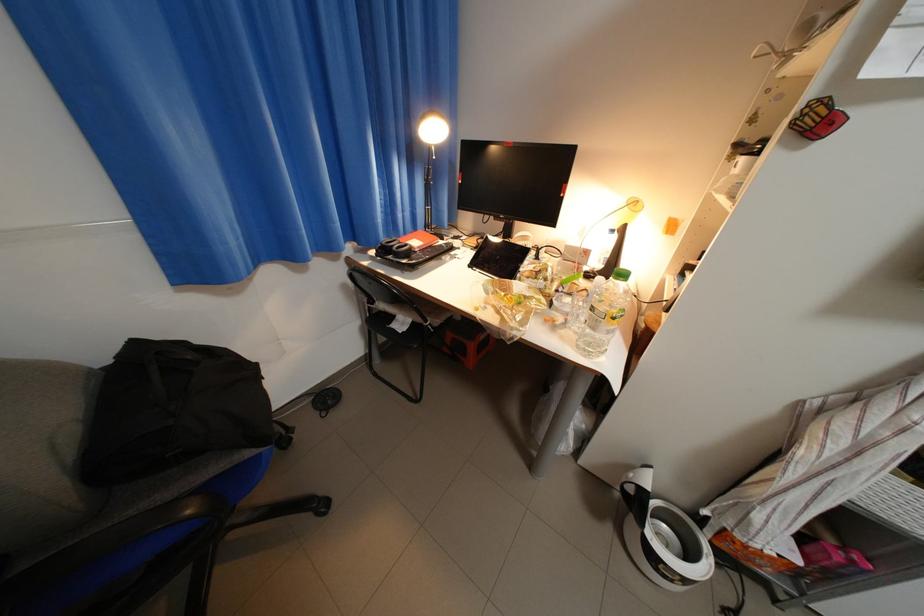
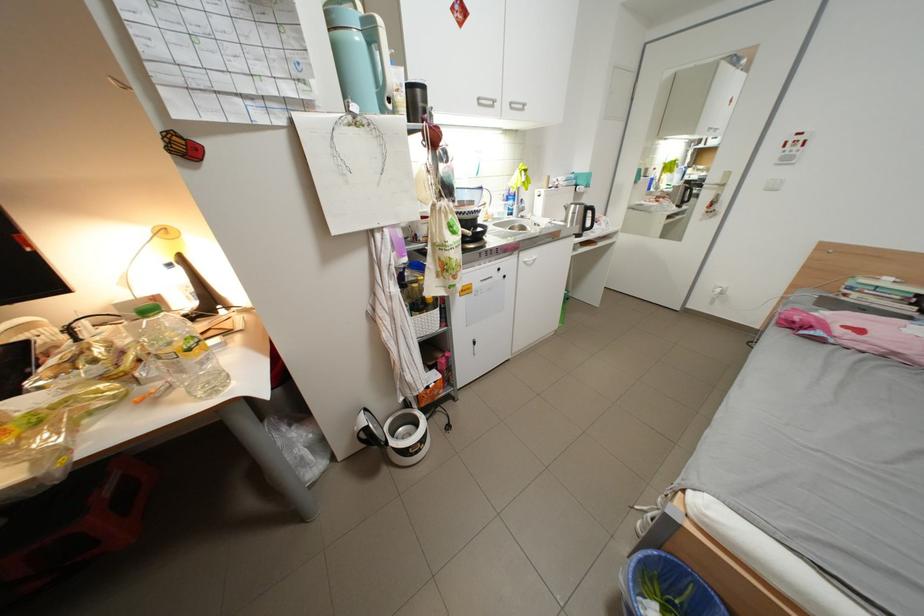
Where in the second image is the point corresponding to point 625,320 from the first image?

(201, 351)